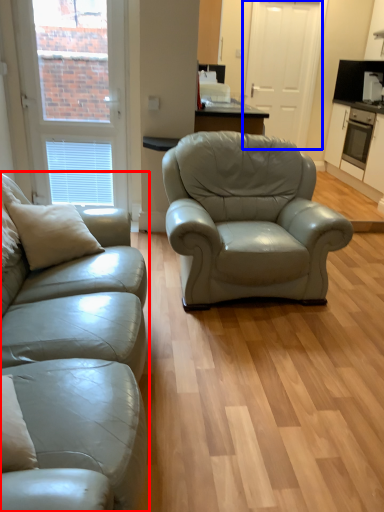
Question: Which of the following is the closest to the observer, studio couch (highlighted by a red box) or screen door (highlighted by a blue box)?

Choices:
 (A) studio couch
 (B) screen door

Answer: (A)